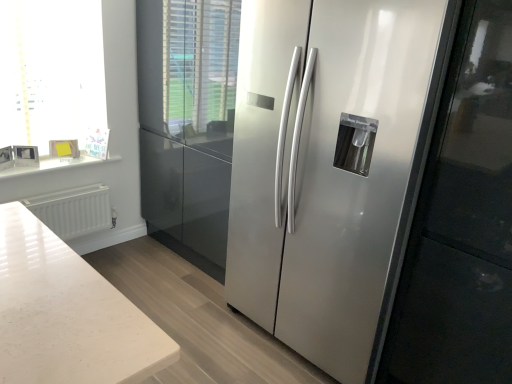
Locate an element on the screen. This screenshot has height=384, width=512. white marble counter top at upper left is located at coordinates (54, 165).

Where is `white glossy frame at upper left`? The width and height of the screenshot is (512, 384). white glossy frame at upper left is located at coordinates (50, 71).

Between white matte radiator at lower left and satin silver refrigerator at center, which one has larger size?

With larger size is satin silver refrigerator at center.

Consider the image. Choose the correct answer: Is white matte radiator at lower left inside satin silver refrigerator at center or outside it?

white matte radiator at lower left is not inside satin silver refrigerator at center, it's outside.

Is white matte radiator at lower left facing towards satin silver refrigerator at center?

Yes.

Is white matte radiator at lower left closer to camera compared to satin silver refrigerator at center?

No, white matte radiator at lower left is further to the viewer.

Between white marble counter top at upper left and white glossy frame at upper left, which one has larger size?

With larger size is white glossy frame at upper left.

Is white marble counter top at upper left at the left side of white glossy frame at upper left?

Incorrect, white marble counter top at upper left is not on the left side of white glossy frame at upper left.

Which is more distant, (48,167) or (1,113)?

Positioned behind is point (48,167).

Would you consider white matte radiator at lower left to be distant from white marble counter top at upper left?

That's not correct — white matte radiator at lower left is a little close to white marble counter top at upper left.

Considering the relative sizes of white matte radiator at lower left and white marble counter top at upper left in the image provided, is white matte radiator at lower left thinner than white marble counter top at upper left?

Correct, the width of white matte radiator at lower left is less than that of white marble counter top at upper left.

Can we say white matte radiator at lower left lies outside white marble counter top at upper left?

Indeed, white matte radiator at lower left is completely outside white marble counter top at upper left.

From a real-world perspective, is white matte radiator at lower left positioned above or below white marble counter top at upper left?

In terms of real-world spatial position, white matte radiator at lower left is below white marble counter top at upper left.

Does satin silver refrigerator at center turn towards white glossy frame at upper left?

No.

From a real-world perspective, does satin silver refrigerator at center stand above white glossy frame at upper left?

No.

Is satin silver refrigerator at center further to camera compared to white glossy frame at upper left?

No, satin silver refrigerator at center is in front of white glossy frame at upper left.

Is white glossy frame at upper left wider than white marble counter top at upper left?

Yes.

From the image's perspective, is white glossy frame at upper left located above or below white marble counter top at upper left?

From the image's perspective, white glossy frame at upper left appears above white marble counter top at upper left.

Can you tell me how much white glossy frame at upper left and white marble counter top at upper left differ in facing direction?

There is a 1.39-degree angle between the facing directions of white glossy frame at upper left and white marble counter top at upper left.

Is white marble counter top at upper left bigger or smaller than satin silver refrigerator at center?

Considering their sizes, white marble counter top at upper left takes up less space than satin silver refrigerator at center.

Between white marble counter top at upper left and satin silver refrigerator at center, which one is positioned in front?

satin silver refrigerator at center is more forward.

Which of these two, white marble counter top at upper left or satin silver refrigerator at center, is thinner?

Thinner between the two is white marble counter top at upper left.

Are white marble counter top at upper left and satin silver refrigerator at center located far from each other?

white marble counter top at upper left is positioned a significant distance from satin silver refrigerator at center.

Considering the sizes of objects white glossy frame at upper left and satin silver refrigerator at center in the image provided, who is bigger, white glossy frame at upper left or satin silver refrigerator at center?

satin silver refrigerator at center.

Considering the sizes of white glossy frame at upper left and satin silver refrigerator at center in the image, is white glossy frame at upper left wider or thinner than satin silver refrigerator at center?

white glossy frame at upper left is thinner than satin silver refrigerator at center.

From a real-world perspective, who is located lower, white glossy frame at upper left or satin silver refrigerator at center?

satin silver refrigerator at center.

From the image's perspective, is white glossy frame at upper left on top of satin silver refrigerator at center?

Yes, from the image's perspective, white glossy frame at upper left is over satin silver refrigerator at center.

Locate an element on the screen. radiator that is on the left side of satin silver refrigerator at center is located at coordinates (73, 210).

Identify the location of counter top that appears on the right of white glossy frame at upper left. The height and width of the screenshot is (384, 512). (54, 165).

Which object lies further to the anchor point white glossy frame at upper left, white marble counter top at upper left or white matte radiator at lower left?

white matte radiator at lower left is positioned further to the anchor white glossy frame at upper left.

Looking at the image, which one is located closer to white marble counter top at upper left, white glossy frame at upper left or satin silver refrigerator at center?

Based on the image, white glossy frame at upper left appears to be nearer to white marble counter top at upper left.

Which object lies further to the anchor point white glossy frame at upper left, satin silver refrigerator at center or white matte radiator at lower left?

Among the two, satin silver refrigerator at center is located further to white glossy frame at upper left.

Looking at this image, estimate the real-world distances between objects in this image. Which object is further from white matte radiator at lower left, white marble counter top at upper left or satin silver refrigerator at center?

satin silver refrigerator at center is further to white matte radiator at lower left.

Based on their spatial positions, is satin silver refrigerator at center or white marble counter top at upper left further from white matte radiator at lower left?

satin silver refrigerator at center is positioned further to the anchor white matte radiator at lower left.

Based on their spatial positions, is white glossy frame at upper left or satin silver refrigerator at center closer to white matte radiator at lower left?

Among the two, white glossy frame at upper left is located nearer to white matte radiator at lower left.

Based on their spatial positions, is satin silver refrigerator at center or white glossy frame at upper left further from white matte radiator at lower left?

satin silver refrigerator at center is positioned further to the anchor white matte radiator at lower left.

When comparing their distances from white marble counter top at upper left, does white matte radiator at lower left or white glossy frame at upper left seem closer?

white matte radiator at lower left is positioned closer to the anchor white marble counter top at upper left.

Where is `radiator between white marble counter top at upper left and satin silver refrigerator at center`? The image size is (512, 384). radiator between white marble counter top at upper left and satin silver refrigerator at center is located at coordinates (73, 210).

Find the location of a particular element. This screenshot has height=384, width=512. counter top between white glossy frame at upper left and satin silver refrigerator at center from left to right is located at coordinates 54,165.

Locate an element on the screen. radiator between white glossy frame at upper left and satin silver refrigerator at center in the horizontal direction is located at coordinates (73, 210).

Where is `counter top between white glossy frame at upper left and white matte radiator at lower left in the up-down direction`? counter top between white glossy frame at upper left and white matte radiator at lower left in the up-down direction is located at coordinates tap(54, 165).